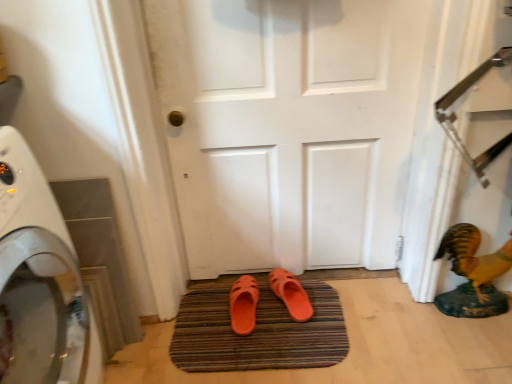
Identify the location of free space to the left of orange rubber slipper at center, the first footwear from the right. (226, 310).